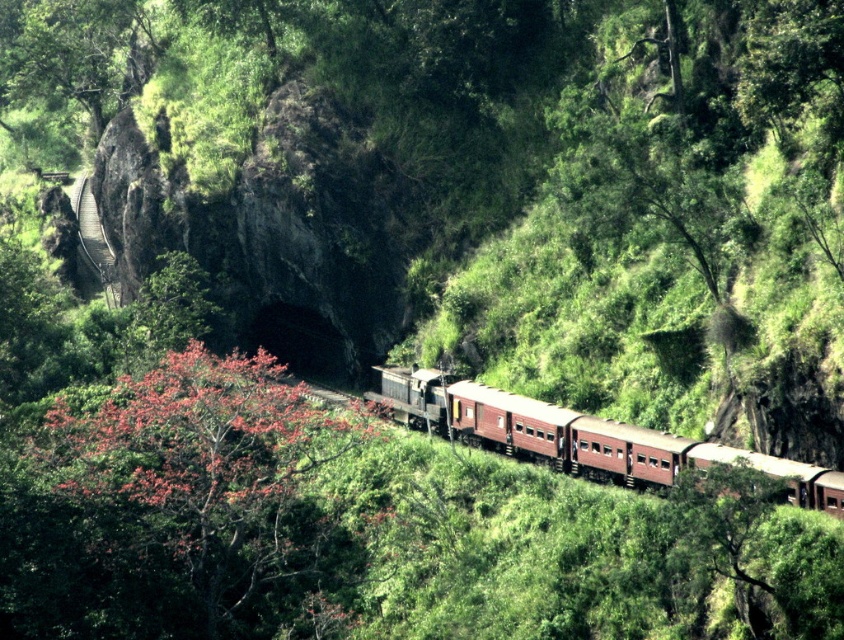
Question: Considering the relative positions of green leafy tree at upper left and metallic train track at left in the image provided, where is green leafy tree at upper left located with respect to metallic train track at left?

Choices:
 (A) left
 (B) right

Answer: (A)

Question: Among these points, which one is farthest from the camera?

Choices:
 (A) (106, 236)
 (B) (136, 490)
 (C) (563, 438)
 (D) (107, 51)

Answer: (D)

Question: Which point is closer to the camera?

Choices:
 (A) (19, 13)
 (B) (79, 186)

Answer: (B)

Question: Is fluffy pink blossoms at center smaller than metallic train track at left?

Choices:
 (A) no
 (B) yes

Answer: (A)

Question: Can you confirm if green leafy tree at upper left is positioned to the left of metallic train track at left?

Choices:
 (A) no
 (B) yes

Answer: (B)

Question: Which of the following is the farthest from the observer?

Choices:
 (A) (73, 196)
 (B) (469, 422)
 (C) (252, 518)
 (D) (85, 90)

Answer: (A)